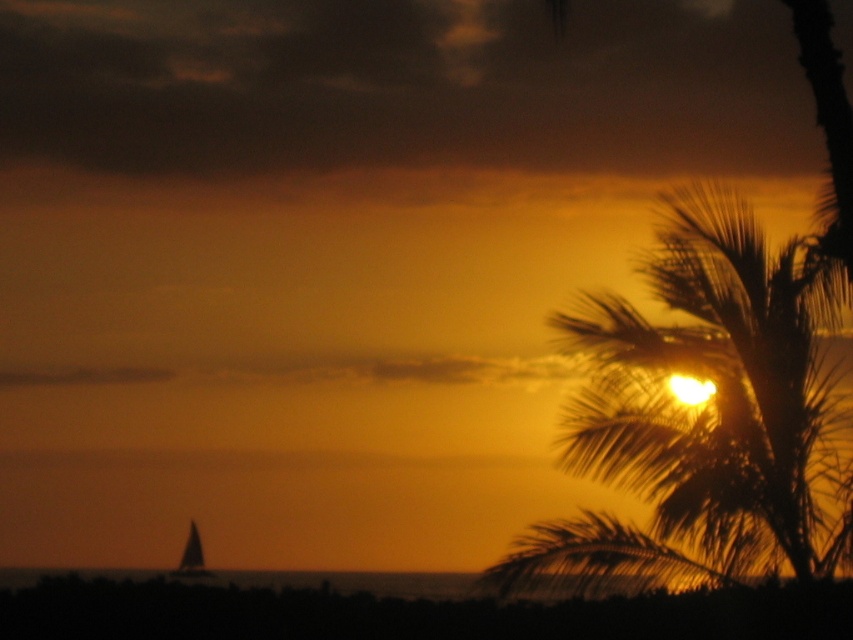
You are an artist trying to sketch the sunset scene. You need to decide which object to draw first based on their sizes. Which one is wider, the silhouette leafy palm at upper right or the silvery reflective sailboat at lower left?

The silhouette leafy palm at upper right is wider than the silvery reflective sailboat at lower left according to the description, so you should draw the silhouette leafy palm at upper right first as it has a larger width.

Based on the photo, you are an artist painting this sunset scene. You want to place a golden sun in the center of the image. Which object should you place the sun closer to, the silhouette leafy palm at upper right or the silvery reflective sailboat at lower left?

The silhouette leafy palm at upper right is positioned on the right side of the silvery reflective sailboat at lower left. Since the sun is partially obscured by the silhouette leafy palm at upper right, the sun should be placed closer to the silhouette leafy palm at upper right to maintain the scene accuracy.